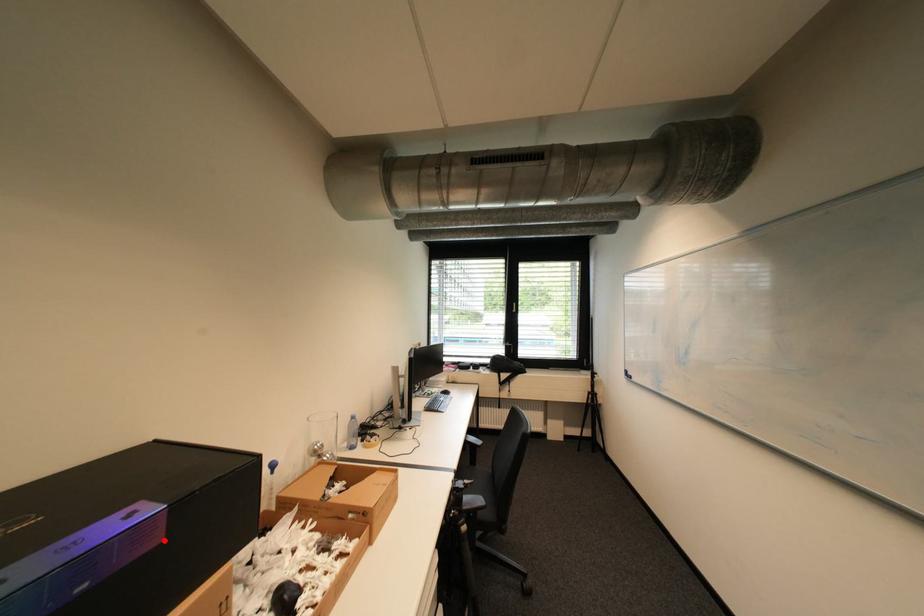
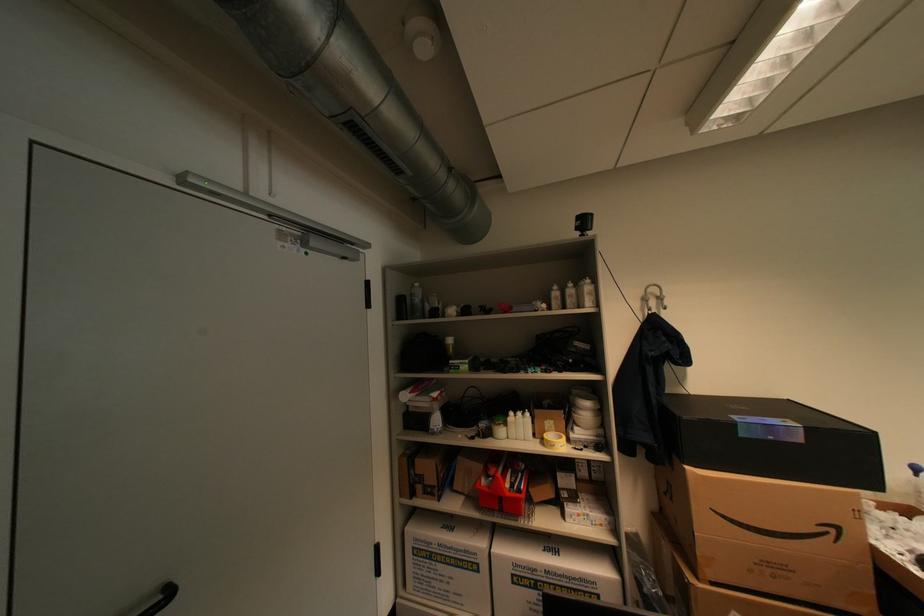
Where in the second image is the point corresponding to the highlighted location from the first image?

(808, 440)